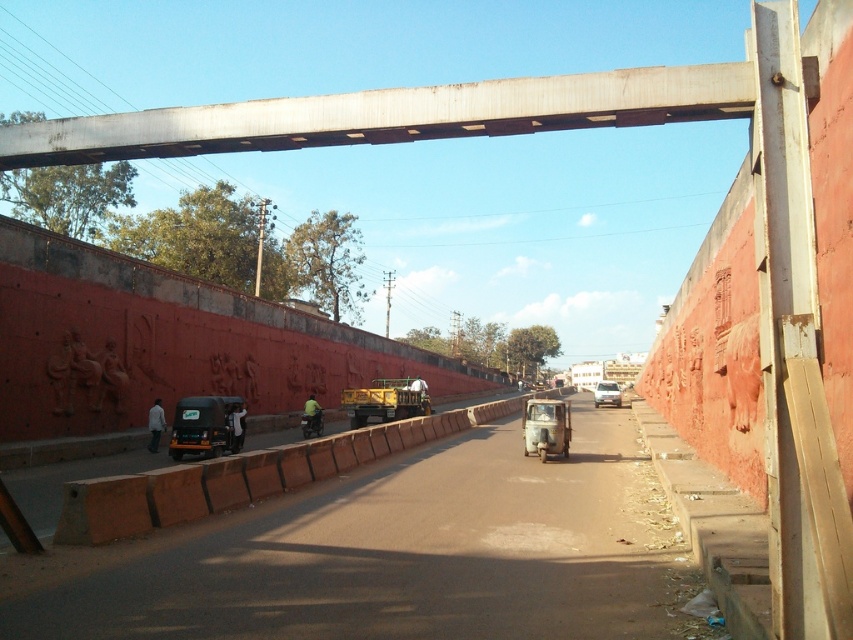
Based on the photo, you are standing at the point labeled point (607, 394) in the image. What vehicle are you standing next to?

You are standing next to the silver metallic sedan at center.

Looking at this image, you are standing at the center of the road and see the point marked at coordinates (242, 476). What is the nearest object to this point?

The point at (242, 476) is on the brown concrete barrier at center, so the nearest object to this point is the brown concrete barrier at center.